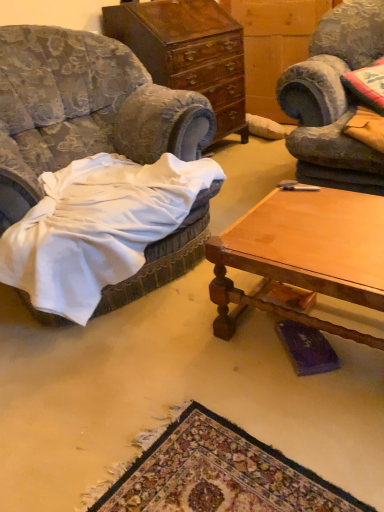
Question: Would you say polished wood cabinet at center is outside velvet blue armchair at left?

Choices:
 (A) no
 (B) yes

Answer: (B)

Question: Is the depth of polished wood cabinet at center greater than that of velvet blue armchair at left?

Choices:
 (A) no
 (B) yes

Answer: (B)

Question: Is velvet blue armchair at left located within polished wood cabinet at center?

Choices:
 (A) no
 (B) yes

Answer: (A)

Question: Does polished wood cabinet at center lie in front of velvet blue armchair at left?

Choices:
 (A) no
 (B) yes

Answer: (A)

Question: Does polished wood cabinet at center have a larger size compared to velvet blue armchair at left?

Choices:
 (A) yes
 (B) no

Answer: (B)

Question: Considering their positions, is velvet blue armchair at left located in front of or behind wooden polished coffee table at center?

Choices:
 (A) behind
 (B) front

Answer: (B)

Question: Looking at their shapes, would you say velvet blue armchair at left is wider or thinner than wooden polished coffee table at center?

Choices:
 (A) wide
 (B) thin

Answer: (A)

Question: From the image's perspective, relative to wooden polished coffee table at center, is velvet blue armchair at left above or below?

Choices:
 (A) above
 (B) below

Answer: (A)

Question: Which is correct: velvet blue armchair at left is inside wooden polished coffee table at center, or outside of it?

Choices:
 (A) inside
 (B) outside

Answer: (B)

Question: In the image, is wooden polished coffee table at center on the left side or the right side of velvet blue armchair at left?

Choices:
 (A) left
 (B) right

Answer: (B)

Question: Considering the positions of wooden polished coffee table at center and velvet blue armchair at left in the image, is wooden polished coffee table at center bigger or smaller than velvet blue armchair at left?

Choices:
 (A) big
 (B) small

Answer: (B)

Question: From their relative heights in the image, would you say wooden polished coffee table at center is taller or shorter than velvet blue armchair at left?

Choices:
 (A) short
 (B) tall

Answer: (A)

Question: Considering the positions of wooden polished coffee table at center and velvet blue armchair at left in the image, is wooden polished coffee table at center wider or thinner than velvet blue armchair at left?

Choices:
 (A) wide
 (B) thin

Answer: (B)

Question: Is point (334, 266) closer or farther from the camera than point (112, 19)?

Choices:
 (A) farther
 (B) closer

Answer: (B)

Question: Is wooden polished coffee table at center situated inside polished wood cabinet at center or outside?

Choices:
 (A) outside
 (B) inside

Answer: (A)